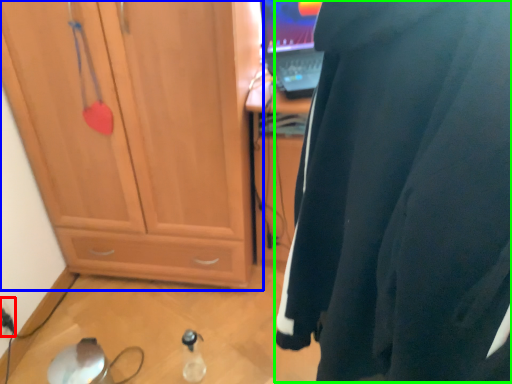
Question: Which object is positioned farthest from electric outlet (highlighted by a red box)? Select from cabinetry (highlighted by a blue box) and wetsuit (highlighted by a green box).

Choices:
 (A) cabinetry
 (B) wetsuit

Answer: (B)